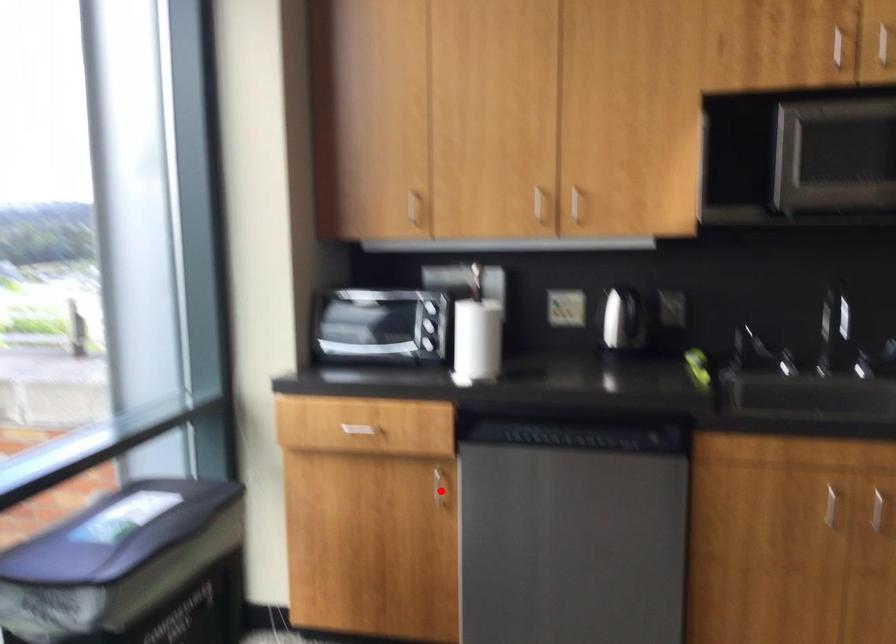
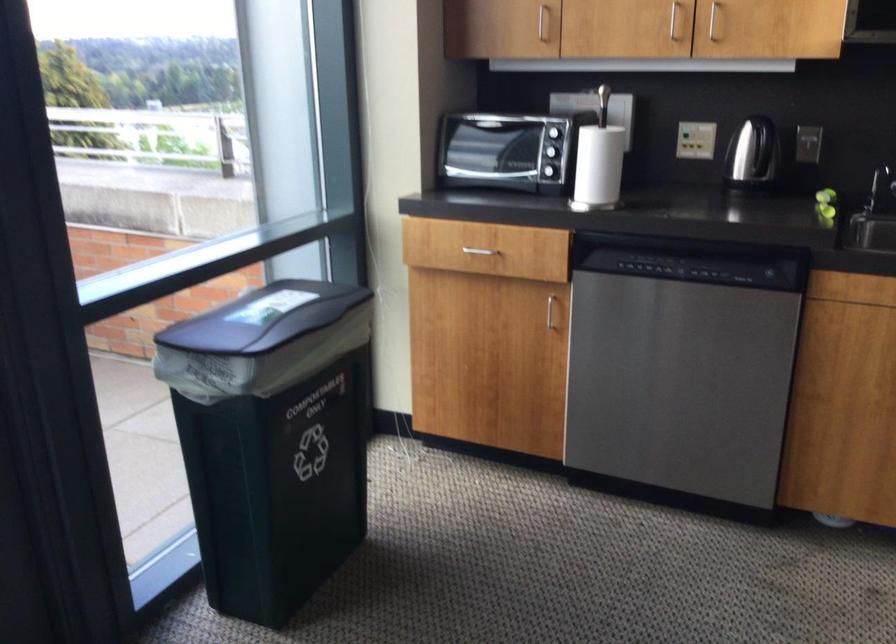
Locate, in the second image, the point that corresponds to the highlighted location in the first image.

(549, 310)